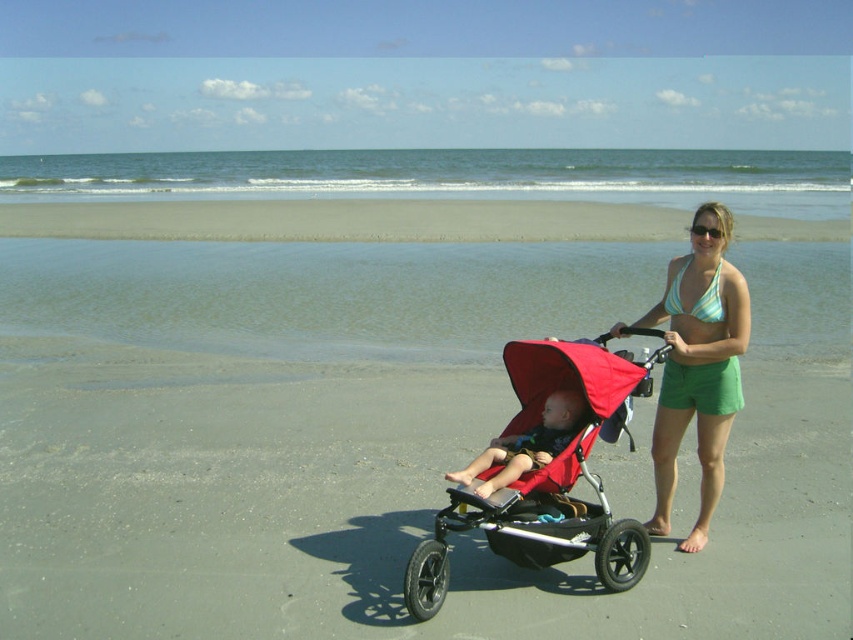
Question: Which object appears closest to the camera in this image?

Choices:
 (A) matte red stroller at center
 (B) red matte stroller at center

Answer: (B)

Question: Is the position of green cotton shorts at center more distant than that of matte red stroller at center?

Choices:
 (A) yes
 (B) no

Answer: (A)

Question: Which object is farther from the camera taking this photo?

Choices:
 (A) matte red stroller at center
 (B) gray sand beach at lower center
 (C) green cotton shorts at center
 (D) red matte stroller at center

Answer: (B)

Question: Considering the relative positions of matte black stroller at center and gray sand beach at lower center in the image provided, where is matte black stroller at center located with respect to gray sand beach at lower center?

Choices:
 (A) right
 (B) left

Answer: (A)

Question: Which object is farther from the camera taking this photo?

Choices:
 (A) matte red stroller at center
 (B) gray sand beach at lower center
 (C) green cotton shorts at center
 (D) matte black stroller at center

Answer: (B)

Question: Is green cotton shorts at center closer to the viewer compared to matte red stroller at center?

Choices:
 (A) no
 (B) yes

Answer: (A)